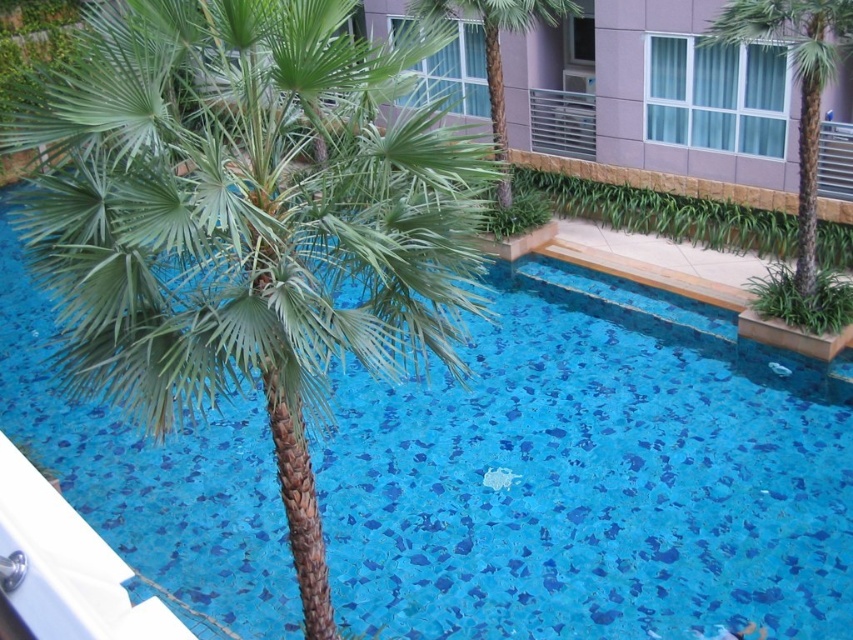
Question: Among these objects, which one is farthest from the camera?

Choices:
 (A) blue mosaic tiles at center
 (B) green leafy palm tree at left
 (C) green leafy palm tree at right
 (D) green leafy palm tree at center

Answer: (D)

Question: Is green leafy palm tree at right bigger than green leafy palm tree at center?

Choices:
 (A) no
 (B) yes

Answer: (A)

Question: Which point is closer to the camera?

Choices:
 (A) (523, 13)
 (B) (328, 124)
 (C) (799, 32)
 (D) (582, 353)

Answer: (B)

Question: Does blue mosaic tiles at center appear on the right side of green leafy palm tree at center?

Choices:
 (A) no
 (B) yes

Answer: (A)

Question: Based on their relative distances, which object is nearer to the green leafy palm tree at center?

Choices:
 (A) blue mosaic tiles at center
 (B) green leafy palm tree at left
 (C) green leafy palm tree at right

Answer: (C)

Question: Can you confirm if blue mosaic tiles at center is smaller than green leafy palm tree at center?

Choices:
 (A) yes
 (B) no

Answer: (B)